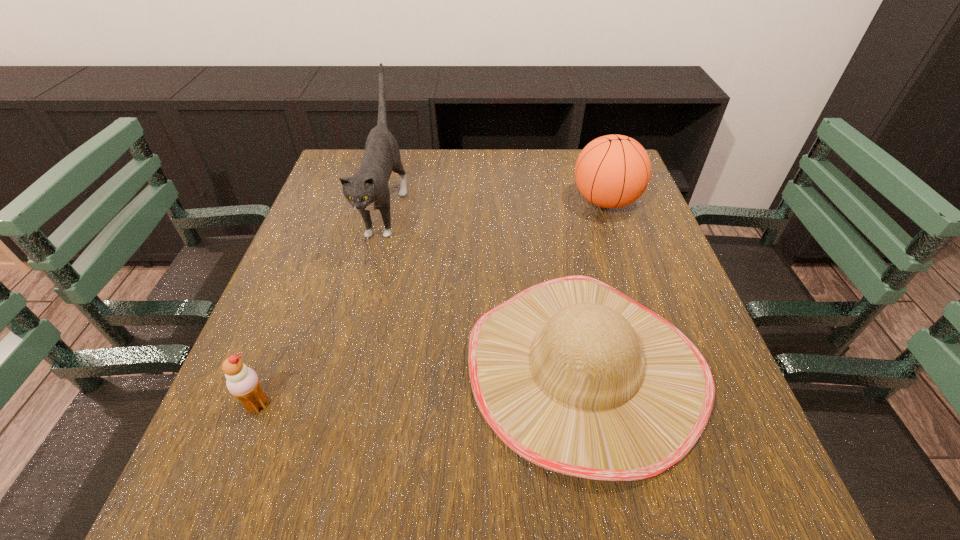
The height and width of the screenshot is (540, 960). What are the coordinates of `basketball positioned at the far edge` in the screenshot? It's located at (612, 171).

I want to click on object present at the near edge, so click(571, 374).

I want to click on cat that is positioned at the left edge, so click(368, 189).

Where is `icecream that is at the left edge`? This screenshot has height=540, width=960. icecream that is at the left edge is located at coordinates (242, 382).

This screenshot has height=540, width=960. What are the coordinates of `basketball situated at the right edge` in the screenshot? It's located at (612, 171).

You are a GUI agent. You are given a task and a screenshot of the screen. Output one action in this format:
    pyautogui.click(x=<x>, y=<y>)
    Task: Click on the sunhat present at the right edge
    The image size is (960, 540).
    Given the screenshot: What is the action you would take?
    pyautogui.click(x=571, y=374)

Where is `object located at the far left corner`? object located at the far left corner is located at coordinates (368, 189).

Identify the location of object that is at the far right corner. This screenshot has height=540, width=960. (612, 171).

Where is `object located in the near right corner section of the desktop`? object located in the near right corner section of the desktop is located at coordinates (571, 374).

The height and width of the screenshot is (540, 960). Identify the location of vacant space at the far edge. (476, 177).